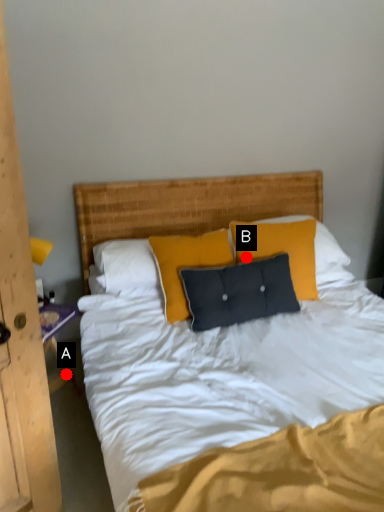
Question: Two points are circled on the image, labeled by A and B beside each circle. Which of the following is the closest to the observer?

Choices:
 (A) A is closer
 (B) B is closer

Answer: (B)